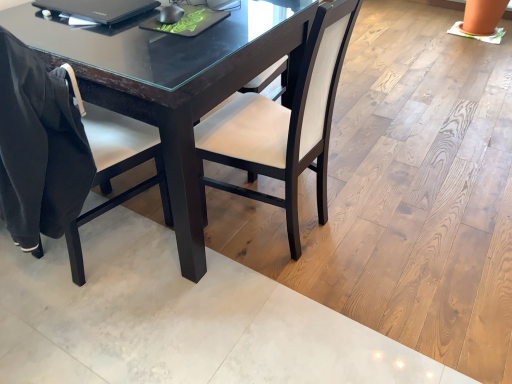
Question: Can you confirm if black glossy laptop at upper left is bigger than satin white chair at center, the 2th chair viewed from the left?

Choices:
 (A) no
 (B) yes

Answer: (A)

Question: Can you confirm if black glossy laptop at upper left is thinner than satin white chair at center, which is the first chair from right to left?

Choices:
 (A) yes
 (B) no

Answer: (A)

Question: Is black glossy laptop at upper left taller than satin white chair at center, which is the first chair from right to left?

Choices:
 (A) no
 (B) yes

Answer: (A)

Question: Is black glossy laptop at upper left positioned behind satin white chair at center, which is the first chair from right to left?

Choices:
 (A) no
 (B) yes

Answer: (B)

Question: Considering the relative sizes of black glossy laptop at upper left and satin white chair at center, which is the first chair from right to left, in the image provided, is black glossy laptop at upper left wider than satin white chair at center, which is the first chair from right to left,?

Choices:
 (A) no
 (B) yes

Answer: (A)

Question: Looking at their shapes, would you say black glossy laptop at upper left is wider or thinner than satin white chair at center, the 2th chair viewed from the left?

Choices:
 (A) wide
 (B) thin

Answer: (B)

Question: From a real-world perspective, is black glossy laptop at upper left positioned above or below satin white chair at center, the 2th chair viewed from the left?

Choices:
 (A) above
 (B) below

Answer: (A)

Question: Is point (110, 23) closer or farther from the camera than point (279, 119)?

Choices:
 (A) farther
 (B) closer

Answer: (B)

Question: Choose the correct answer: Is black glossy laptop at upper left inside satin white chair at center, which is the first chair from right to left, or outside it?

Choices:
 (A) outside
 (B) inside

Answer: (A)

Question: In terms of width, does black glossy laptop at upper left look wider or thinner when compared to black matte chair at left, placed as the first chair when sorted from left to right?

Choices:
 (A) wide
 (B) thin

Answer: (B)

Question: Considering the positions of point (72, 6) and point (76, 137), is point (72, 6) closer or farther from the camera than point (76, 137)?

Choices:
 (A) farther
 (B) closer

Answer: (A)

Question: Is black glossy laptop at upper left to the left or to the right of black matte chair at left, placed as the first chair when sorted from left to right, in the image?

Choices:
 (A) right
 (B) left

Answer: (A)

Question: From a real-world perspective, is black glossy laptop at upper left above or below black matte chair at left, placed as the first chair when sorted from left to right?

Choices:
 (A) above
 (B) below

Answer: (A)

Question: From the image's perspective, is satin white chair at center, the 2th chair viewed from the left, positioned above or below black glossy laptop at upper left?

Choices:
 (A) above
 (B) below

Answer: (B)

Question: In terms of width, does satin white chair at center, which is the first chair from right to left, look wider or thinner when compared to black glossy laptop at upper left?

Choices:
 (A) thin
 (B) wide

Answer: (B)